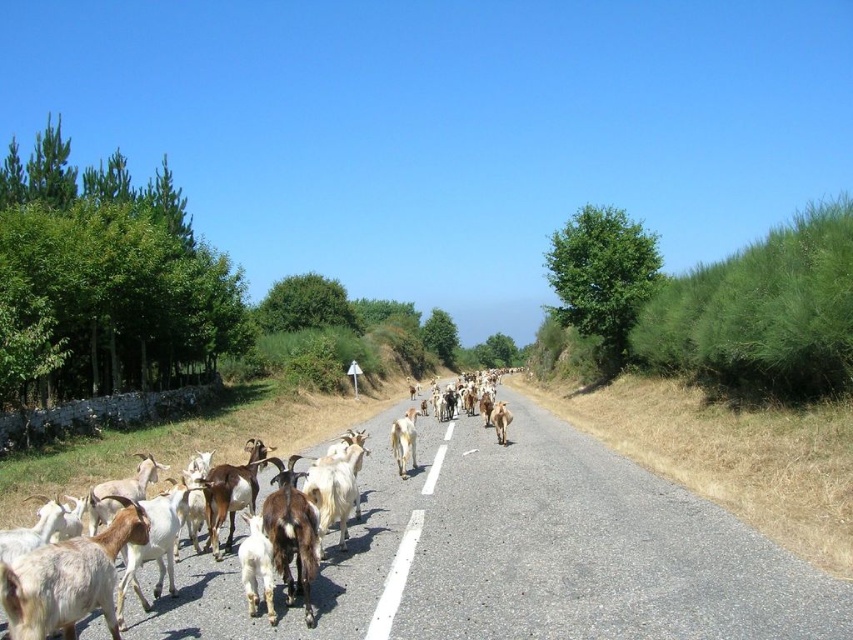
You are driving a car that is 4 meters long and need to pass through the gap between the white woolen goat at lower left and the white woolen goat at center. Can your car fit through the gap?

The gap between the white woolen goat at lower left and the white woolen goat at center is 8.59 meters. Since the car is 4 meters long, it can easily fit through the gap as the distance is more than double the car length.

You are a delivery driver approaching a rural road with a herd of goats crossing. The asphalt road at center has a width of 5.31 meters. Your truck is 2.5 meters wide. Can you safely pass through the road without hitting any goats?

The asphalt road at center is 5.31 meters wide. Since your truck is 2.5 meters wide, there is enough space to pass safely as long as you stay centered and avoid the goats.